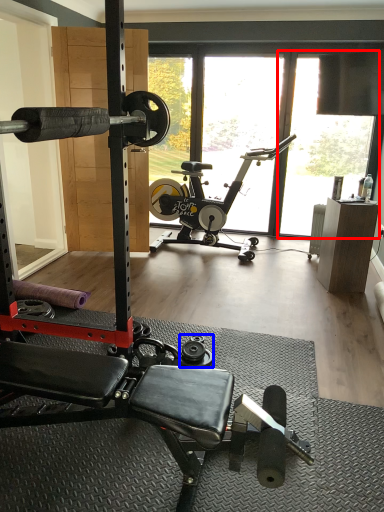
Question: Which object appears farthest to the camera in this image, window screen (highlighted by a red box) or dumbbell (highlighted by a blue box)?

Choices:
 (A) window screen
 (B) dumbbell

Answer: (A)